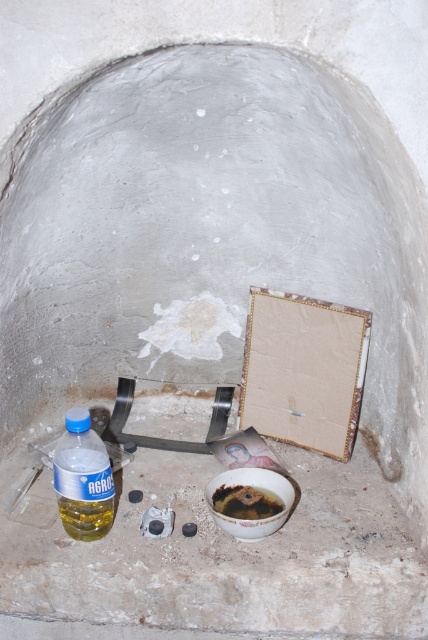
Question: Which is nearer to the brown matte bowl at center?

Choices:
 (A) yellow translucent oil at lower left
 (B) translucent yellow plastic bottle at lower left

Answer: (A)

Question: Can you confirm if yellow translucent oil at lower left is thinner than brown matte bowl at center?

Choices:
 (A) yes
 (B) no

Answer: (A)

Question: Which point is farther from the camera taking this photo?

Choices:
 (A) (255, 502)
 (B) (77, 456)
 (C) (83, 534)

Answer: (A)

Question: Does yellow translucent oil at lower left appear over brown matte bowl at center?

Choices:
 (A) yes
 (B) no

Answer: (B)

Question: Among these points, which one is farthest from the camera?

Choices:
 (A) (101, 472)
 (B) (225, 488)
 (C) (74, 534)

Answer: (B)

Question: Does translucent yellow plastic bottle at lower left appear on the left side of brown matte bowl at center?

Choices:
 (A) no
 (B) yes

Answer: (B)